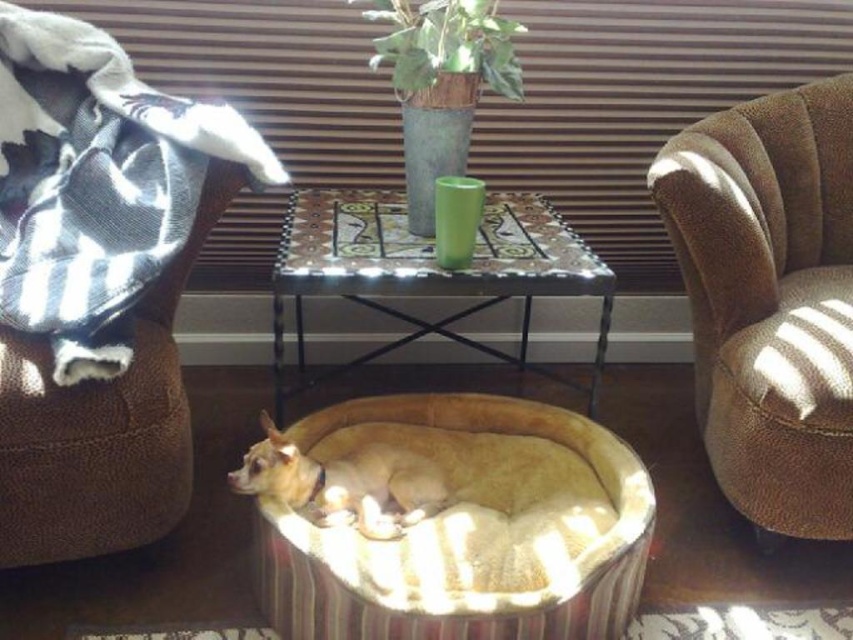
Measure the distance from velvet beige dog bed at center to black and white striped fabric at upper left.

They are 23.60 inches apart.

Which is more to the right, velvet beige dog bed at center or black and white striped fabric at upper left?

From the viewer's perspective, velvet beige dog bed at center appears more on the right side.

Where is `velvet beige dog bed at center`? velvet beige dog bed at center is located at coordinates (451, 522).

Is brown textured armchair at right behind fuzzy beige dog at center?

Yes, it is behind fuzzy beige dog at center.

Between point (712, 250) and point (428, 515), which one is positioned behind?

The point (712, 250) is behind.

Find the location of a particular element. The image size is (853, 640). brown textured armchair at right is located at coordinates (770, 300).

Is point (276, 508) positioned in front of point (699, 323)?

Yes, it is.

Is velvet beige dog bed at center to the right of brown textured armchair at right from the viewer's perspective?

Incorrect, velvet beige dog bed at center is not on the right side of brown textured armchair at right.

Is point (404, 481) farther from viewer compared to point (840, 280)?

No, (404, 481) is closer to viewer.

At what (x,y) coordinates should I click in order to perform the action: click on velvet beige dog bed at center. Please return your answer as a coordinate pair (x, y). This screenshot has height=640, width=853. Looking at the image, I should click on (451, 522).